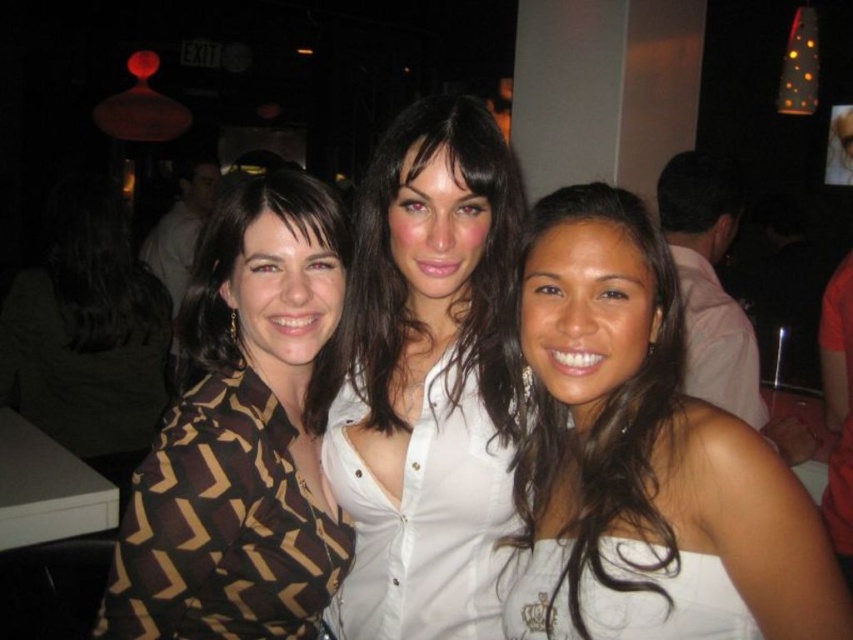
Who is positioned more to the left, white satin blouse at center or pink fabric at upper right?

Positioned to the left is white satin blouse at center.

Is point (444, 404) farther from camera compared to point (704, 300)?

No.

At what (x,y) coordinates should I click in order to perform the action: click on white satin blouse at center. Please return your answer as a coordinate pair (x, y). Looking at the image, I should click on (427, 380).

Who is more distant from viewer, (419, 422) or (318, 474)?

The point (318, 474) is more distant.

What do you see at coordinates (427, 380) in the screenshot? I see `white satin blouse at center` at bounding box center [427, 380].

Image resolution: width=853 pixels, height=640 pixels. What do you see at coordinates (427, 380) in the screenshot?
I see `white satin blouse at center` at bounding box center [427, 380].

Find the location of `white satin blouse at center`. white satin blouse at center is located at coordinates (427, 380).

Who is more distant from viewer, (x=641, y=404) or (x=753, y=358)?

Point (x=753, y=358)

From the picture: Is white satin dress at center shorter than pink fabric at upper right?

Indeed, white satin dress at center has a lesser height compared to pink fabric at upper right.

Who is more forward, [590,268] or [728,401]?

Point [590,268]

Identify the location of white satin dress at center. This screenshot has height=640, width=853. (x=643, y=458).